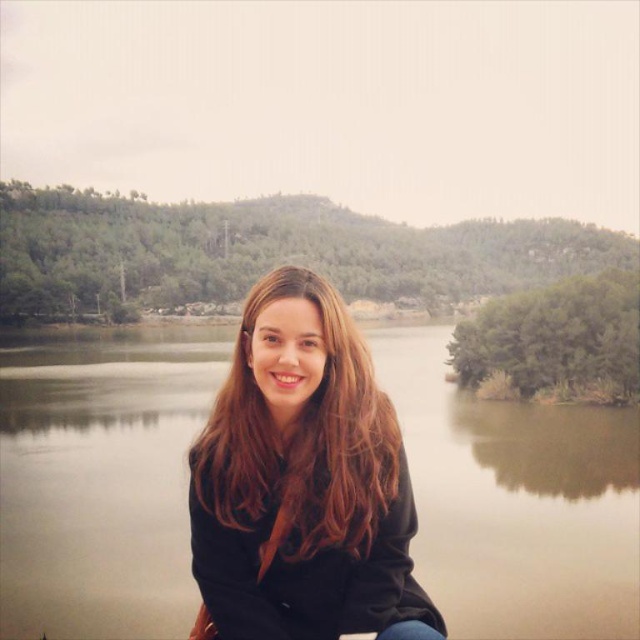
What do you see at coordinates (100, 477) in the screenshot? I see `green matte water at center` at bounding box center [100, 477].

Between point (115, 365) and point (369, 502), which one is positioned in front?

Point (369, 502)

Who is more distant from viewer, (x=182, y=369) or (x=388, y=472)?

The point (x=182, y=369) is behind.

Locate an element on the screen. This screenshot has height=640, width=640. green matte water at center is located at coordinates click(100, 477).